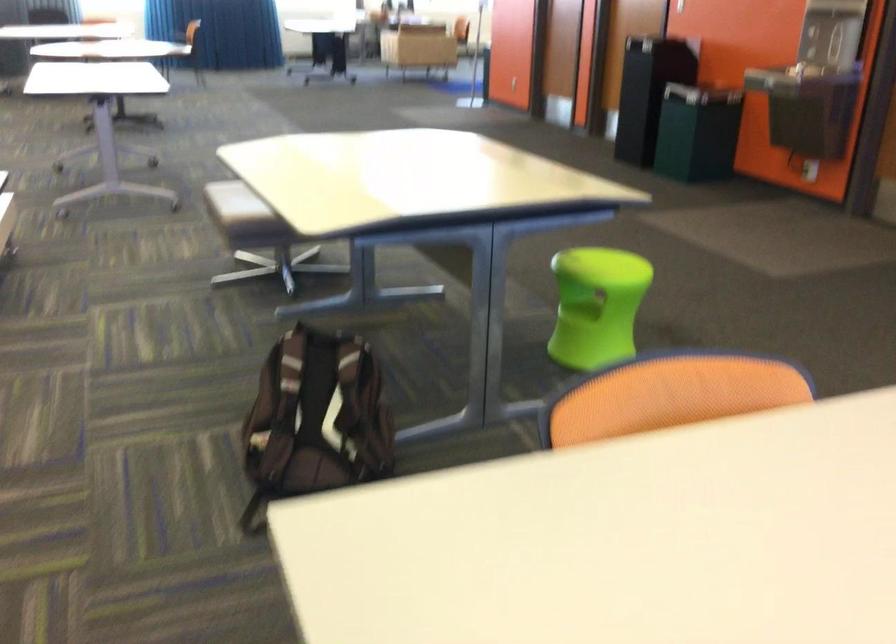
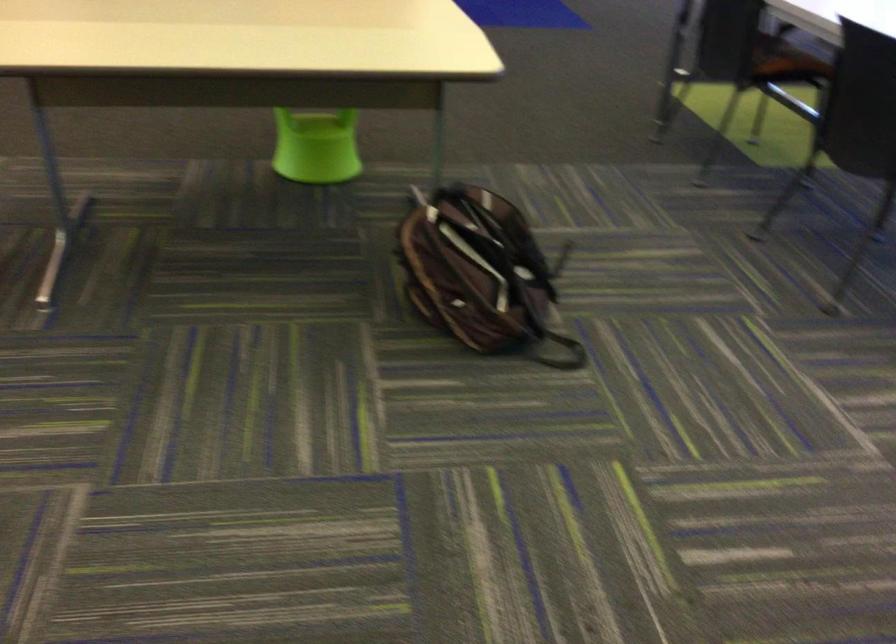
Question: I am providing you with two images of the same scene from different viewpoints. Please identify which objects are invisible in image2.

Choices:
 (A) black backpack strap
 (B) green chair sitting surface
 (C) chair sitting surface
 (D) none of these

Answer: (D)